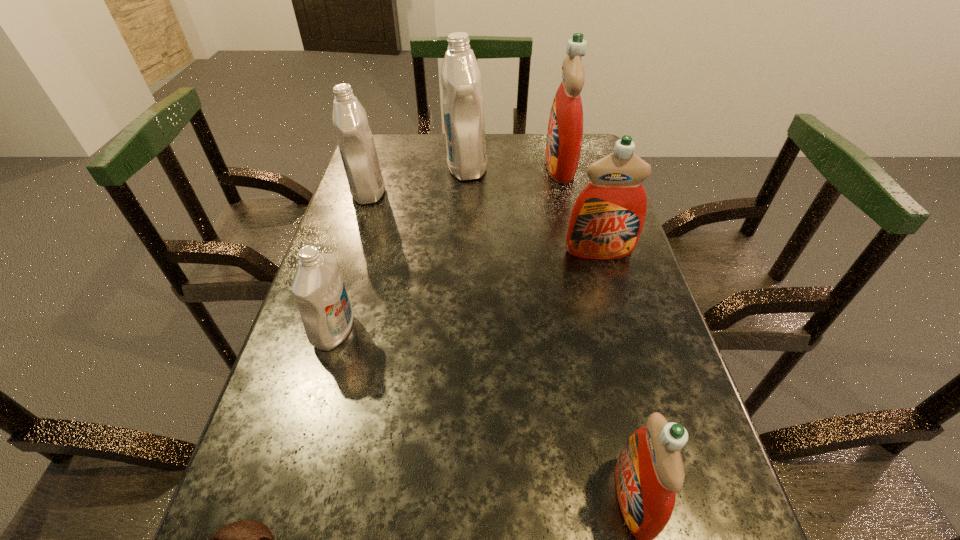
Identify the location of vacant region that satisfies the following two spatial constraints: 1. on the back side of the third detergent from left to right; 2. on the left side of the smallest white detergent. The image size is (960, 540). coord(382,167).